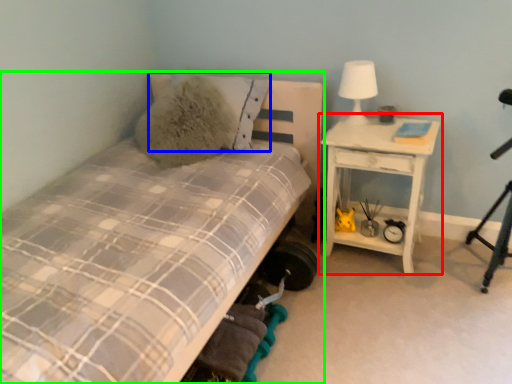
Question: Estimate the real-world distances between objects in this image. Which object is farther from nightstand (highlighted by a red box), pillow (highlighted by a blue box) or bed (highlighted by a green box)?

Choices:
 (A) pillow
 (B) bed

Answer: (B)